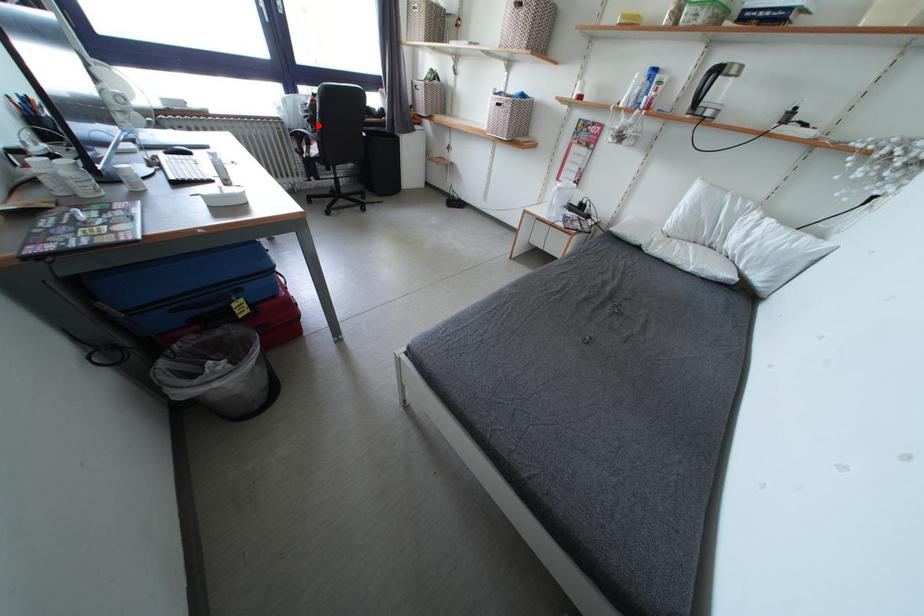
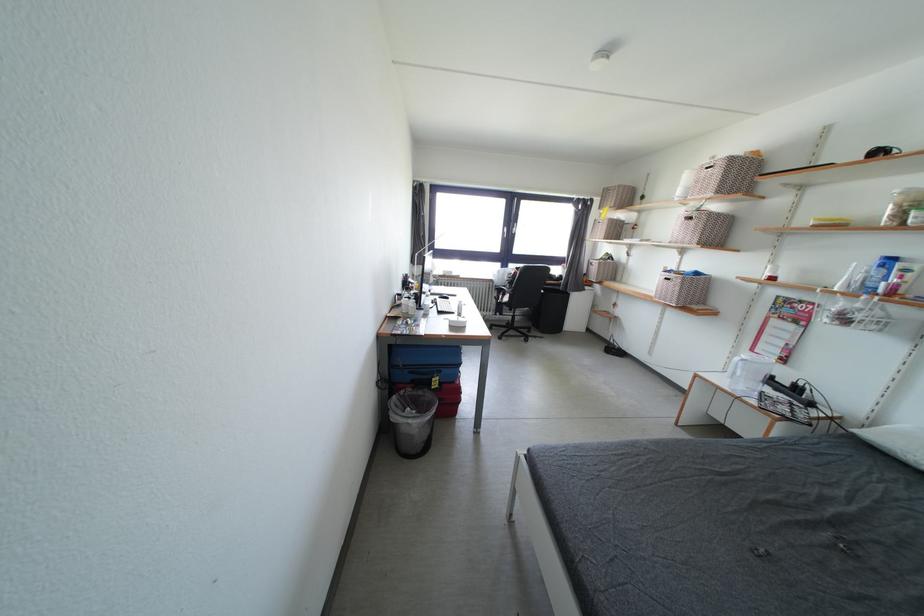
Find the pixel in the second image that matches the highlighted location in the first image.

(517, 286)